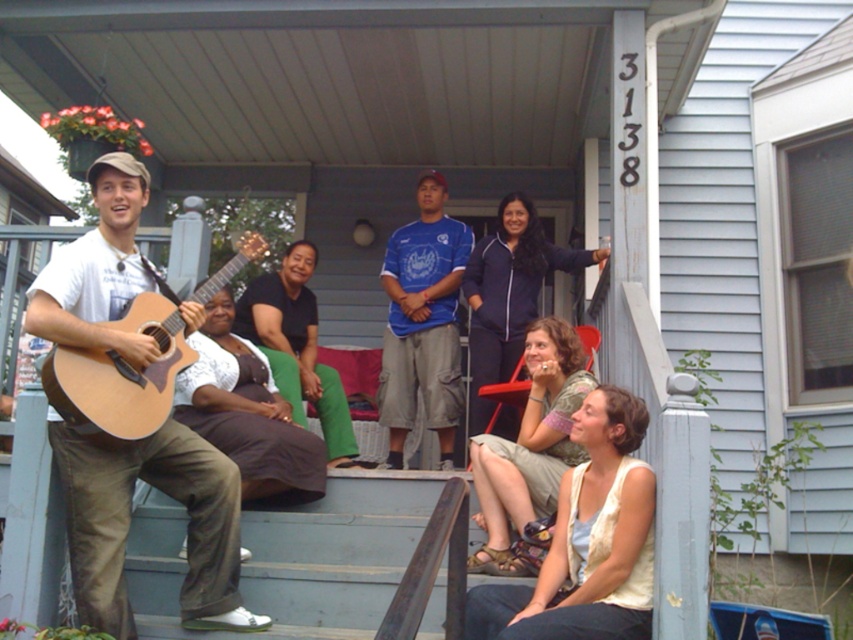
Who is more forward, (555, 364) or (315, 260)?

Point (555, 364) is in front.

Locate an element on the screen. The width and height of the screenshot is (853, 640). light beige fabric skirt at lower right is located at coordinates (529, 445).

Does point (495, 476) come in front of point (283, 365)?

Yes, it is.

Identify the location of light beige fabric skirt at lower right. The image size is (853, 640). (529, 445).

Which is above, wooden porch at center or dark blue fleece jacket at upper center?

dark blue fleece jacket at upper center

Where is `wooden porch at center`? The image size is (853, 640). wooden porch at center is located at coordinates (296, 557).

In order to click on wooden porch at center in this screenshot , I will do `click(296, 557)`.

Is the position of wooden porch at center more distant than that of light beige vest at lower right?

Yes, it is.

Based on the photo, does wooden porch at center appear under light beige vest at lower right?

Yes.

The image size is (853, 640). What are the coordinates of `wooden porch at center` in the screenshot? It's located at (296, 557).

The width and height of the screenshot is (853, 640). Find the location of `wooden porch at center`. wooden porch at center is located at coordinates (296, 557).